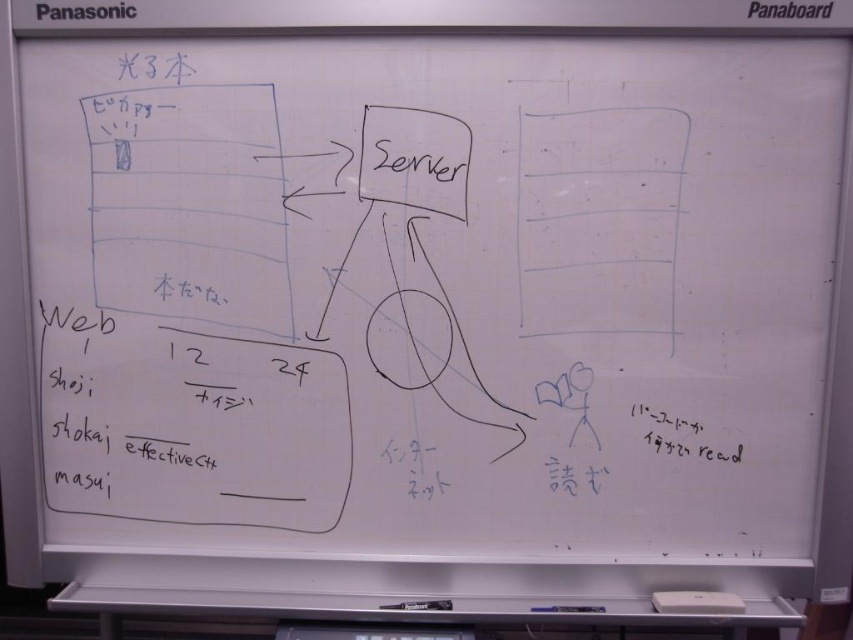
You are organizing your desk and need to place a 10.5 inch long ruler between the black paper at lower right and the white matte eraser at bottom. Can the ruler fit in the space between them?

The black paper at lower right is 11.18 inches away from the white matte eraser at bottom. Since the ruler is 10.5 inches long, it can fit in the space between them as the distance is sufficient.

Based on the photo, you are organizing a classroom and need to place the black paper at lower right and the white matte eraser at bottom on a shelf. If the shelf has limited space, which item should you place first to maximize shelf usage?

The black paper at lower right has a larger width than the white matte eraser at bottom, so you should place the black paper at lower right first to accommodate its larger size and optimize shelf space usage.